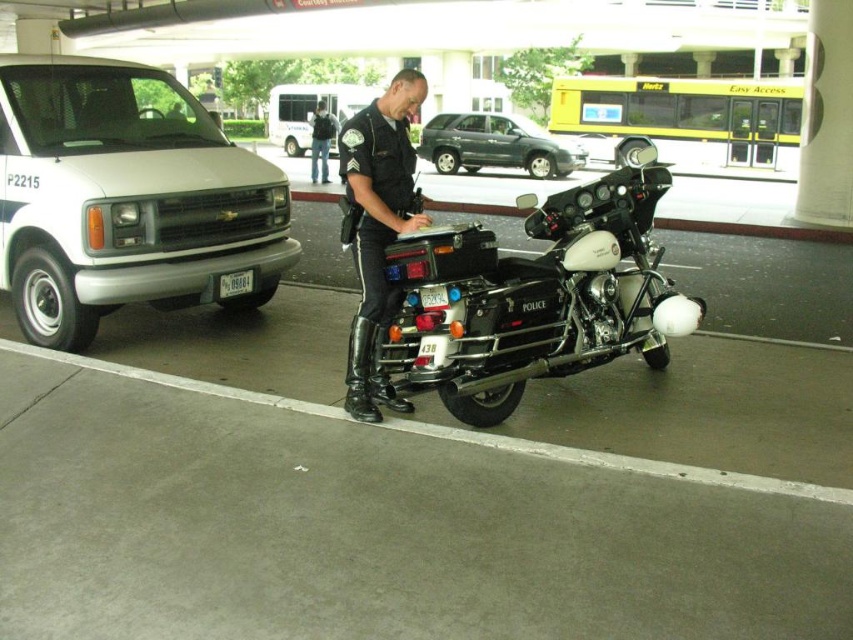
Question: Is metallic gray suv at center further to the viewer compared to white plastic license plate at center?

Choices:
 (A) yes
 (B) no

Answer: (A)

Question: Is the position of yellow/glass bus at upper center less distant than that of metallic gray suv at center?

Choices:
 (A) no
 (B) yes

Answer: (A)

Question: Can you confirm if shiny black police motorcycle at center is thinner than white plastic license plate at center?

Choices:
 (A) yes
 (B) no

Answer: (B)

Question: Which point is closer to the camera taking this photo?

Choices:
 (A) (618, 84)
 (B) (450, 321)
 (C) (286, 100)

Answer: (B)

Question: Which point appears closest to the camera in this image?

Choices:
 (A) (228, 278)
 (B) (465, 138)

Answer: (A)

Question: Which point is closer to the camera taking this photo?

Choices:
 (A) (311, 124)
 (B) (416, 272)
 (C) (521, 134)

Answer: (B)